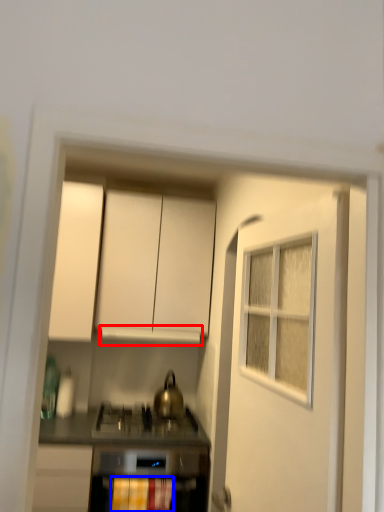
Question: Which object appears closest to the camera in this image, vent (highlighted by a red box) or curtain (highlighted by a blue box)?

Choices:
 (A) vent
 (B) curtain

Answer: (B)